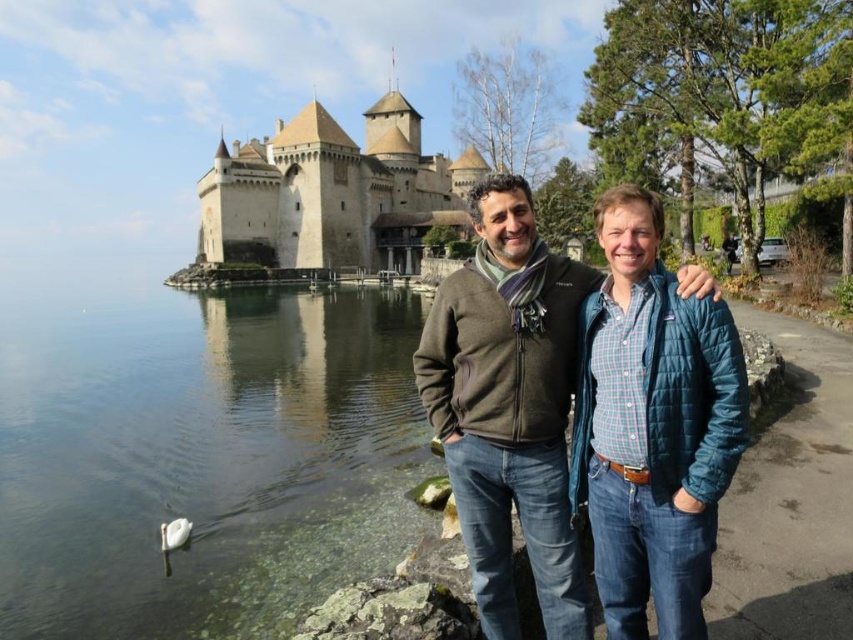
Question: Is clear water at lake left bigger than white matte swan at lower left?

Choices:
 (A) no
 (B) yes

Answer: (B)

Question: Among these objects, which one is farthest from the camera?

Choices:
 (A) clear water at lake left
 (B) white matte swan at lower left

Answer: (B)

Question: Estimate the real-world distances between objects in this image. Which object is closer to the matte brown jacket at center?

Choices:
 (A) clear water at lake left
 (B) white matte swan at lower left
 (C) teal quilted jacket at center
 (D) stone medieval castle at upper center

Answer: (C)

Question: Which of these objects is positioned closest to the white matte swan at lower left?

Choices:
 (A) stone medieval castle at upper center
 (B) clear water at lake left

Answer: (B)

Question: Does clear water at lake left appear on the right side of teal quilted jacket at center?

Choices:
 (A) no
 (B) yes

Answer: (A)

Question: Can you confirm if clear water at lake left is smaller than stone medieval castle at upper center?

Choices:
 (A) no
 (B) yes

Answer: (B)